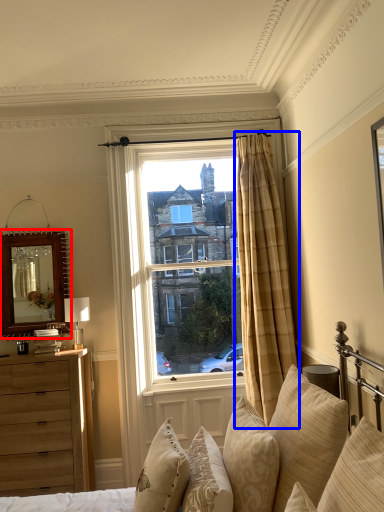
Question: Which point is closer to the camera, mirror (highlighted by a red box) or curtain (highlighted by a blue box)?

Choices:
 (A) mirror
 (B) curtain

Answer: (B)